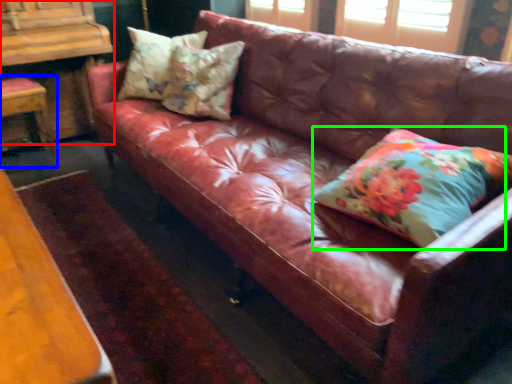
Question: Which is farther away from dresser (highlighted by a red box)? chair (highlighted by a blue box) or pillow (highlighted by a green box)?

Choices:
 (A) chair
 (B) pillow

Answer: (B)